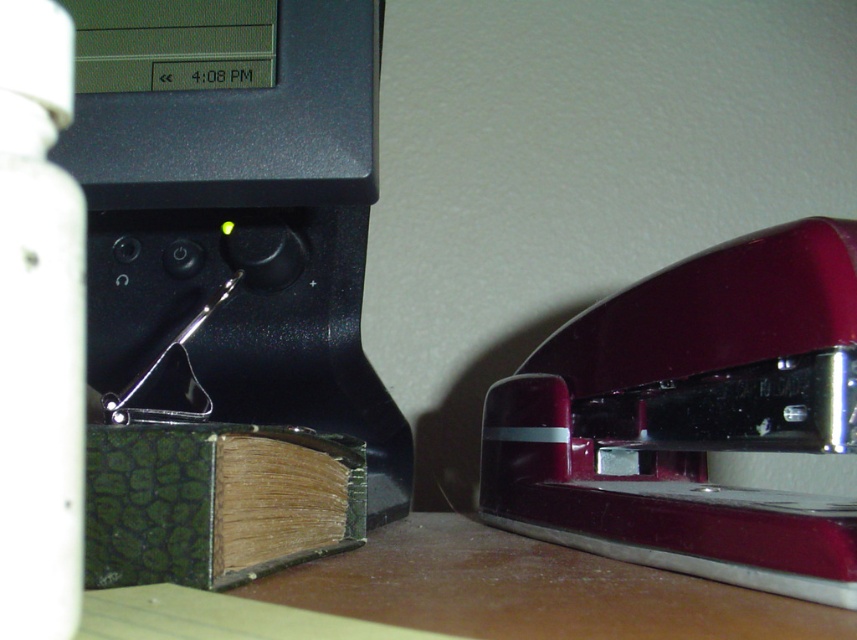
You are organizing items on your desk and need to place a new item between the black electronic device on the left and the glossy maroon stapler at lower right. Based on their positions, where should you place the new item?

The new item should be placed between the black electronic device on the left and the glossy maroon stapler at lower right, closer to the latter since the stapler is positioned at point (692, 417) which is further to the right compared to the device.

You are organizing items on a desk and need to place a new item between the glossy maroon stapler at lower right and the green textured book at lower left. Given their heights, which item should you place closer to the edge of the desk to avoid blocking the view of the lower one?

The glossy maroon stapler at lower right is much taller than the green textured book at lower left. To avoid blocking the view of the lower item, you should place the taller glossy maroon stapler at lower right closer to the edge of the desk so that the shorter green textured book at lower left remains visible.

You are looking at the desk from above. There are two points marked on the desk. One is at point (x=688, y=344) and the other is at point (x=156, y=456). If you were to draw a straight line from your viewpoint directly to each point, which point would be closer to you?

Point (x=156, y=456) is closer to you because it is in front of point (x=688, y=344).